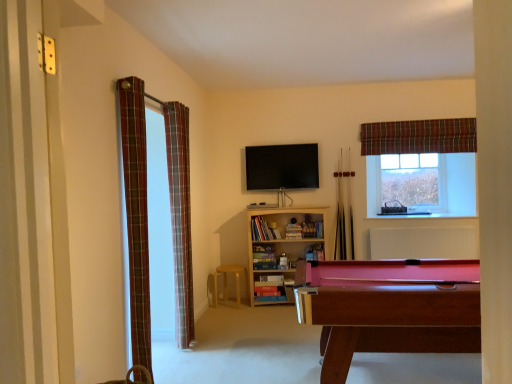
Question: Based on their sizes in the image, would you say clear glass window at upper right is bigger or smaller than plaid fabric curtain at left, the second curtain in the front-to-back sequence?

Choices:
 (A) small
 (B) big

Answer: (A)

Question: From a real-world perspective, is clear glass window at upper right positioned above or below plaid fabric curtain at left, which ranks as the second curtain in right-to-left order?

Choices:
 (A) above
 (B) below

Answer: (A)

Question: Based on their relative distances, which object is nearer to the light brown wooden stool at center?

Choices:
 (A) mahogany wood pool table at lower right
 (B) white textured radiator at center
 (C) wooden bookshelf at center
 (D) plaid fabric curtain at left, acting as the 2th curtain starting from the back
 (E) clear glass window at upper right

Answer: (C)

Question: Which object is the farthest from the plaid fabric curtain at upper right, which ranks as the third curtain in left-to-right order?

Choices:
 (A) wooden pool cue at center, the second cue from the left
 (B) white textured radiator at center
 (C) light brown wooden stool at center
 (D) plaid fabric curtain at left, which ranks as the second curtain in right-to-left order
 (E) wooden pool cue at center, arranged as the 2th cue when viewed from the right

Answer: (D)